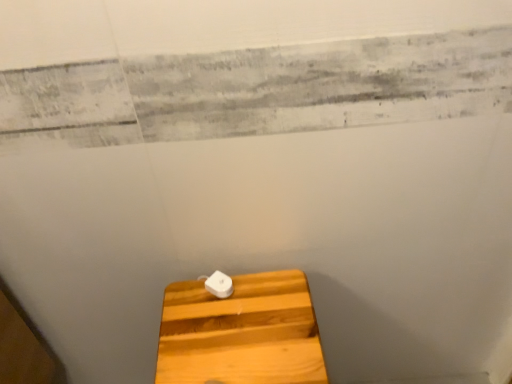
At what (x,y) coordinates should I click in order to perform the action: click on free point above light wood cutting board at center (from a real-world perspective). Please return your answer as a coordinate pair (x, y). The width and height of the screenshot is (512, 384). Looking at the image, I should click on (245, 326).